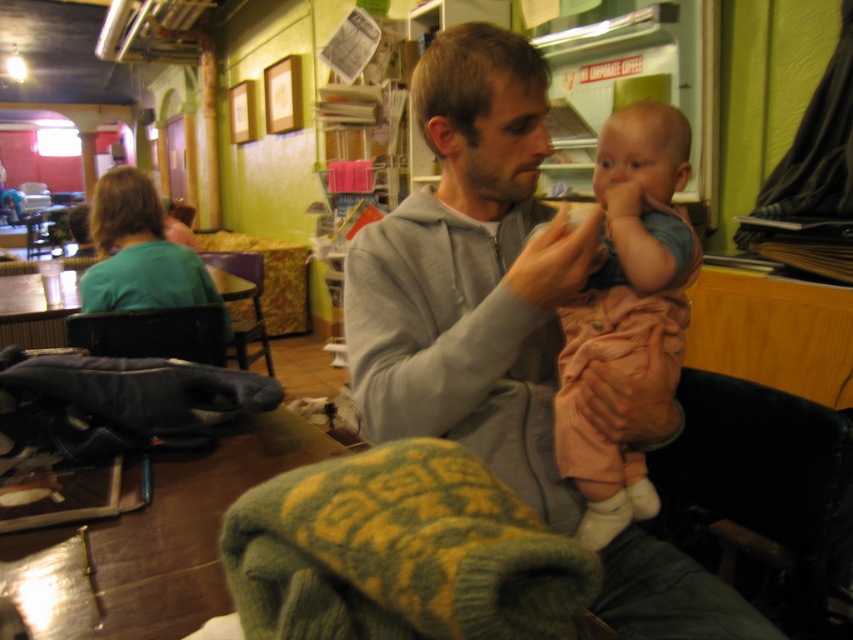
Question: Does matte green shirt at upper left appear over black leather chair at lower left?

Choices:
 (A) yes
 (B) no

Answer: (A)

Question: Can you confirm if black leather chair at lower right is positioned below pink fabric baby at center?

Choices:
 (A) no
 (B) yes

Answer: (B)

Question: Which of these objects is positioned closest to the matte green shirt at upper left?

Choices:
 (A) black leather chair at lower left
 (B) black leather chair at lower right
 (C) pink fabric baby at center

Answer: (A)

Question: Which point is farther from the camera taking this photo?

Choices:
 (A) (602, 477)
 (B) (204, 260)
 (C) (844, 515)

Answer: (B)

Question: Can you confirm if pink fabric baby at center is positioned above wooden chair at center?

Choices:
 (A) no
 (B) yes

Answer: (A)

Question: Which point is closer to the camera?

Choices:
 (A) (659, 461)
 (B) (96, 305)

Answer: (A)